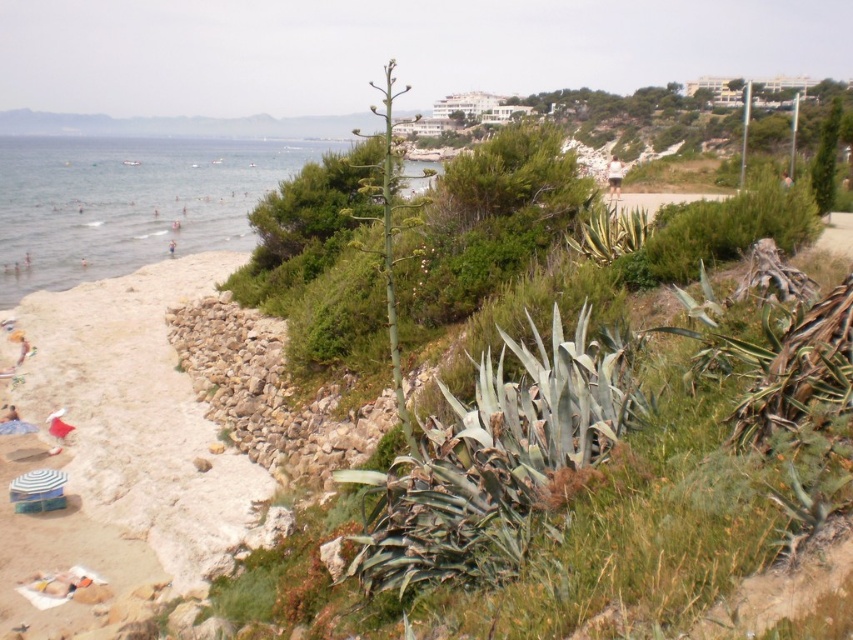
You are standing at the center of the beach and want to place a small flag exactly where the beige sand at lower left is located. According to the coordinates provided, what are the exact coordinates where you should place the flag?

The beige sand at lower left is located at point (134, 432), so you should place the flag at coordinates (134, 432).

You are a beachgoer who wants to set up your beach umbrella. You have a clear blue water at beach left and a white fabric at lower left in your view. Which object should you place your umbrella closer to if you want it to be near the water but not directly on the fabric?

You should place your umbrella closer to the clear blue water at beach left since it is located above the white fabric at lower left, ensuring it is near the water without being on the fabric.

You are standing on the beach and see the beige sand at lower left and the white fabric at lower left. Which object is nearer to you?

The beige sand at lower left is closer to the viewer than the white fabric at lower left, so the beige sand at lower left is nearer to you.